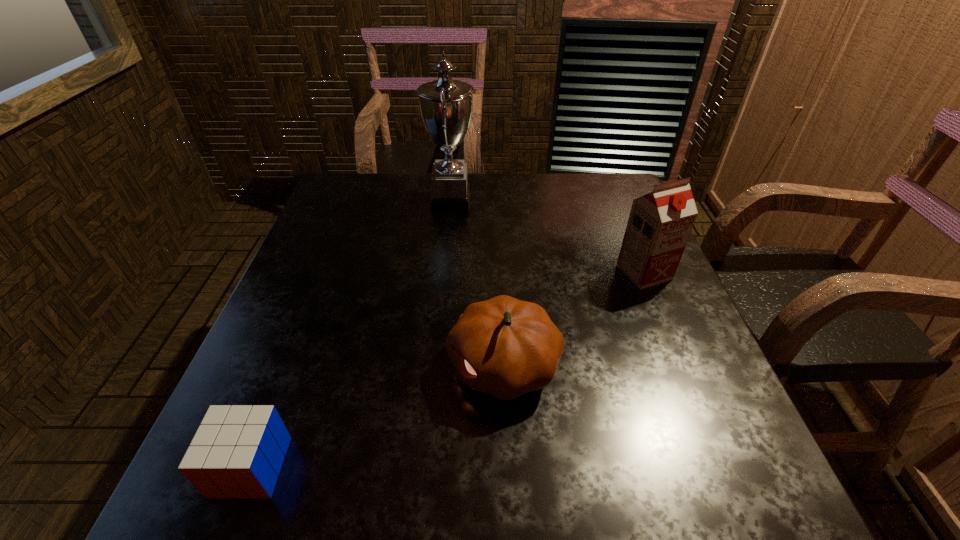
Locate an element on the screen. vacant space in between the farthest object and the nearest object is located at coordinates (351, 333).

You are a GUI agent. You are given a task and a screenshot of the screen. Output one action in this format:
    pyautogui.click(x=<x>, y=<y>)
    Task: Click on the free area in between the rightmost object and the second shortest object
    Image resolution: width=960 pixels, height=540 pixels.
    Given the screenshot: What is the action you would take?
    pyautogui.click(x=574, y=319)

Locate an element on the screen. This screenshot has width=960, height=540. vacant area between the tallest object and the third tallest object is located at coordinates (477, 282).

Identify the location of empty space between the cube and the third farthest object. (377, 416).

Locate which object is the closest to the shortest object. Please provide its 2D coordinates. Your answer should be formatted as a tuple, i.e. [(x, y)], where the tuple contains the x and y coordinates of a point satisfying the conditions above.

[(505, 347)]

Locate an element on the screen. object that stands as the third closest to the soya milk is located at coordinates (237, 452).

This screenshot has height=540, width=960. Find the location of `free space that satisfies the following two spatial constraints: 1. at the front view of the farthest object; 2. on the right side of the second tallest object`. free space that satisfies the following two spatial constraints: 1. at the front view of the farthest object; 2. on the right side of the second tallest object is located at coordinates (444, 272).

Where is `free space that satisfies the following two spatial constraints: 1. on the back side of the second tallest object; 2. at the front view of the trophy cup`? The width and height of the screenshot is (960, 540). free space that satisfies the following two spatial constraints: 1. on the back side of the second tallest object; 2. at the front view of the trophy cup is located at coordinates (614, 200).

Where is `vacant point that satisfies the following two spatial constraints: 1. on the front face of the third farthest object; 2. on the front side of the cube`? The height and width of the screenshot is (540, 960). vacant point that satisfies the following two spatial constraints: 1. on the front face of the third farthest object; 2. on the front side of the cube is located at coordinates (509, 467).